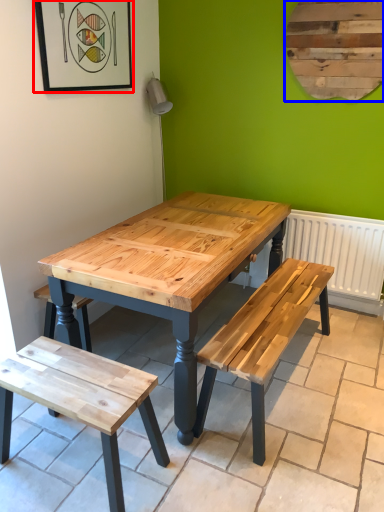
Question: Which object is closer to the camera taking this photo, picture frame (highlighted by a red box) or bulletin board (highlighted by a blue box)?

Choices:
 (A) picture frame
 (B) bulletin board

Answer: (A)